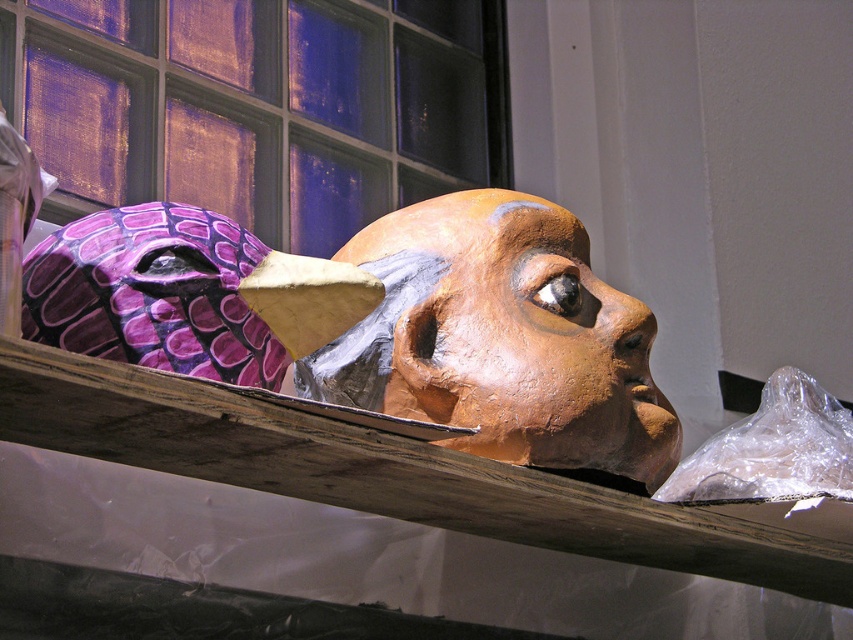
Can you confirm if blue glass window at upper center is bigger than matte brown mask at center?

Correct, blue glass window at upper center is larger in size than matte brown mask at center.

Who is shorter, blue glass window at upper center or matte brown mask at center?

Standing shorter between the two is matte brown mask at center.

Which is behind, point (379, 196) or point (515, 284)?

Point (379, 196)

Locate an element on the screen. The image size is (853, 640). blue glass window at upper center is located at coordinates (260, 106).

Can you confirm if blue glass window at upper center is positioned above matte purple/scaly dragon head at center?

Indeed, blue glass window at upper center is positioned over matte purple/scaly dragon head at center.

Does blue glass window at upper center have a lesser width compared to matte purple/scaly dragon head at center?

Yes.

Who is more forward, (x=488, y=72) or (x=364, y=397)?

Point (x=364, y=397)

At what (x,y) coordinates should I click in order to perform the action: click on blue glass window at upper center. Please return your answer as a coordinate pair (x, y). The width and height of the screenshot is (853, 640). Looking at the image, I should click on (260, 106).

Which is behind, point (306, 396) or point (643, 456)?

The point (306, 396) is behind.

Can you confirm if matte purple/scaly dragon head at center is thinner than matte brown mask at center?

No.

The image size is (853, 640). I want to click on matte purple/scaly dragon head at center, so click(502, 339).